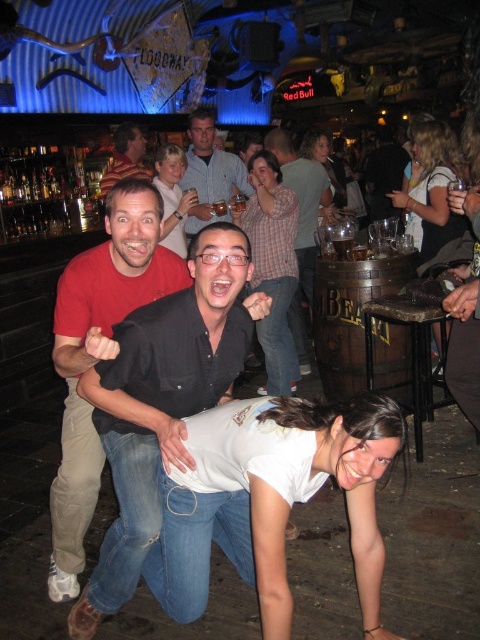
Does matte plaid shirt at center have a lesser height compared to matte black shirt at center?

No.

The image size is (480, 640). What do you see at coordinates (273, 266) in the screenshot?
I see `matte plaid shirt at center` at bounding box center [273, 266].

At what (x,y) coordinates should I click in order to perform the action: click on matte plaid shirt at center. Please return your answer as a coordinate pair (x, y). The image size is (480, 640). Looking at the image, I should click on (273, 266).

Between black shirt at center and blonde hair at upper right, which one appears on the right side from the viewer's perspective?

blonde hair at upper right is more to the right.

Image resolution: width=480 pixels, height=640 pixels. Find the location of `black shirt at center`. black shirt at center is located at coordinates pos(163,401).

Between point (107, 417) and point (450, 161), which one is positioned behind?

The point (450, 161) is behind.

Find the location of a particular element. This screenshot has height=640, width=480. black shirt at center is located at coordinates (163, 401).

Is matte black shirt at center to the left of striped shirt at upper left from the viewer's perspective?

In fact, matte black shirt at center is to the right of striped shirt at upper left.

Can you confirm if matte black shirt at center is positioned below striped shirt at upper left?

Indeed, matte black shirt at center is positioned under striped shirt at upper left.

In the scene shown: Who is more forward, (168, 214) or (123, 145)?

Positioned in front is point (168, 214).

Locate an element on the screen. matte black shirt at center is located at coordinates coord(172,196).